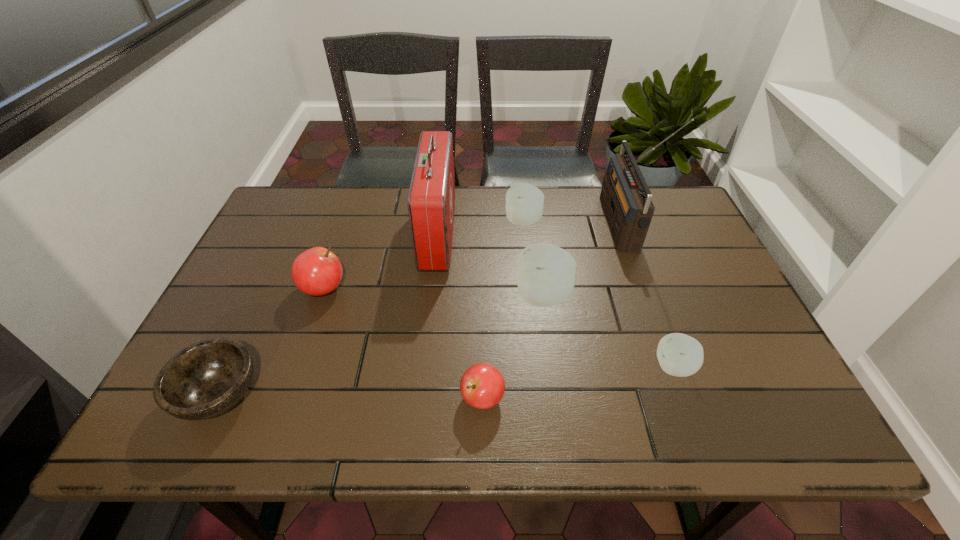
You are a GUI agent. You are given a task and a screenshot of the screen. Output one action in this format:
    pyautogui.click(x=<x>, y=<y>)
    Task: Click on the blank space that satisfies the following two spatial constraints: 1. on the side of the second nearest white apple with the first aid cross symbol; 2. on the right side of the seventh shortest object
    Image resolution: width=960 pixels, height=540 pixels.
    Given the screenshot: What is the action you would take?
    [431, 296]